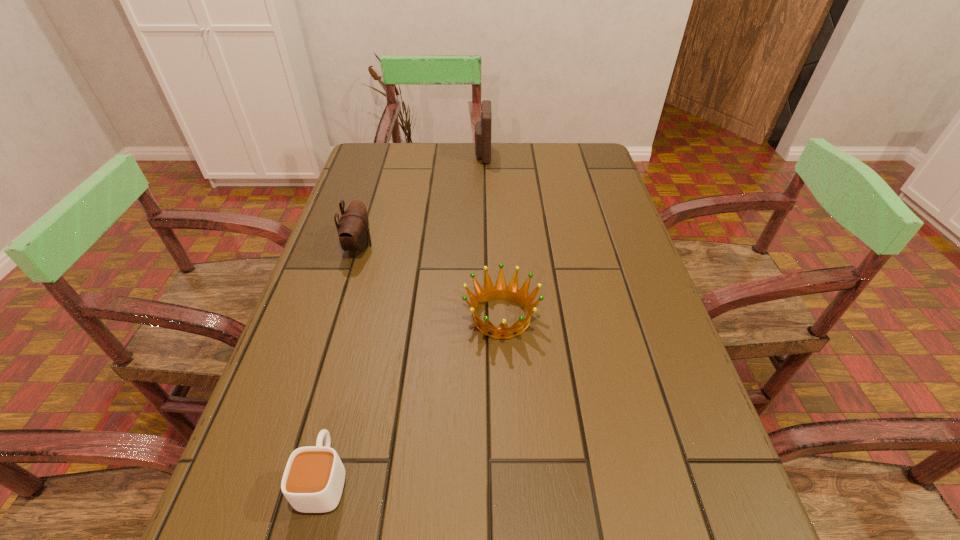
Locate an element on the screen. This screenshot has height=540, width=960. free region at the far right corner of the desktop is located at coordinates (569, 160).

What are the coordinates of `empty space that is in between the crown and the second tallest object` in the screenshot? It's located at (430, 281).

Locate an element on the screen. Image resolution: width=960 pixels, height=540 pixels. free area in between the second tallest object and the tallest object is located at coordinates (420, 200).

You are a GUI agent. You are given a task and a screenshot of the screen. Output one action in this format:
    pyautogui.click(x=<x>, y=<y>)
    Task: Click on the vacant space that is in between the farther pouch and the third farthest object
    
    Given the screenshot: What is the action you would take?
    (x=492, y=236)

This screenshot has height=540, width=960. In order to click on vacant space that is in between the cup and the crown in this screenshot , I will do `click(413, 397)`.

Where is `free space between the farther pouch and the nearer pouch`? The height and width of the screenshot is (540, 960). free space between the farther pouch and the nearer pouch is located at coordinates coord(420,200).

At what (x,y) coordinates should I click in order to perform the action: click on vacant area that lies between the shorter pouch and the second nearest object. Please return your answer as a coordinate pair (x, y). Looking at the image, I should click on (430, 281).

At what (x,y) coordinates should I click in order to perform the action: click on vacant space in between the crown and the cup. Please return your answer as a coordinate pair (x, y). This screenshot has width=960, height=540. Looking at the image, I should click on (413, 397).

Image resolution: width=960 pixels, height=540 pixels. Find the location of `vacant area that lies between the cup and the taller pouch`. vacant area that lies between the cup and the taller pouch is located at coordinates (403, 316).

The image size is (960, 540). I want to click on free space between the crown and the tallest object, so coord(492,236).